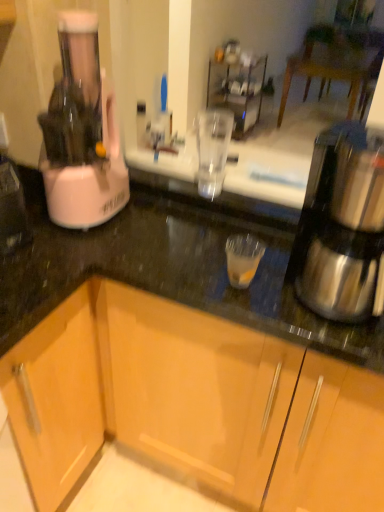
Question: Is wooden cabinet at lower center, acting as the 1th cabinetry starting from the right, far from shiny metallic coffee maker at right?

Choices:
 (A) no
 (B) yes

Answer: (A)

Question: Considering the relative sizes of wooden cabinet at lower center, acting as the 1th cabinetry starting from the right, and shiny metallic coffee maker at right in the image provided, is wooden cabinet at lower center, acting as the 1th cabinetry starting from the right, taller than shiny metallic coffee maker at right?

Choices:
 (A) no
 (B) yes

Answer: (B)

Question: Is wooden cabinet at lower center, the 2th cabinetry positioned from the left, shorter than shiny metallic coffee maker at right?

Choices:
 (A) no
 (B) yes

Answer: (A)

Question: Is wooden cabinet at lower center, acting as the 1th cabinetry starting from the right, in front of shiny metallic coffee maker at right?

Choices:
 (A) yes
 (B) no

Answer: (A)

Question: From the image's perspective, is wooden cabinet at lower center, the 2th cabinetry positioned from the left, located beneath shiny metallic coffee maker at right?

Choices:
 (A) no
 (B) yes

Answer: (B)

Question: Is black granite countertop at center taller or shorter than white plastic blender at left?

Choices:
 (A) short
 (B) tall

Answer: (A)

Question: Based on their sizes in the image, would you say black granite countertop at center is bigger or smaller than white plastic blender at left?

Choices:
 (A) big
 (B) small

Answer: (A)

Question: Is black granite countertop at center wider or thinner than white plastic blender at left?

Choices:
 (A) wide
 (B) thin

Answer: (A)

Question: Is black granite countertop at center to the left or to the right of white plastic blender at left in the image?

Choices:
 (A) left
 (B) right

Answer: (B)

Question: Is white plastic blender at left to the left or to the right of black granite countertop at center in the image?

Choices:
 (A) left
 (B) right

Answer: (A)

Question: Considering their positions, is white plastic blender at left located in front of or behind black granite countertop at center?

Choices:
 (A) front
 (B) behind

Answer: (B)

Question: From a real-world perspective, is white plastic blender at left above or below black granite countertop at center?

Choices:
 (A) below
 (B) above

Answer: (B)

Question: From the image's perspective, is white plastic blender at left located above or below black granite countertop at center?

Choices:
 (A) above
 (B) below

Answer: (A)

Question: From the image's perspective, is shiny metallic coffee maker at right positioned above or below wooden cabinet at lower left, the first cabinetry in the left-to-right sequence?

Choices:
 (A) below
 (B) above

Answer: (B)

Question: In terms of height, does shiny metallic coffee maker at right look taller or shorter compared to wooden cabinet at lower left, the first cabinetry in the left-to-right sequence?

Choices:
 (A) tall
 (B) short

Answer: (B)